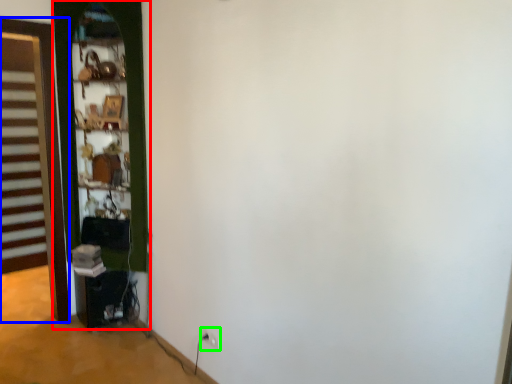
Question: Which object is the farthest from door (highlighted by a red box)? Choose among these: door (highlighted by a blue box) or electric outlet (highlighted by a green box).

Choices:
 (A) door
 (B) electric outlet

Answer: (A)